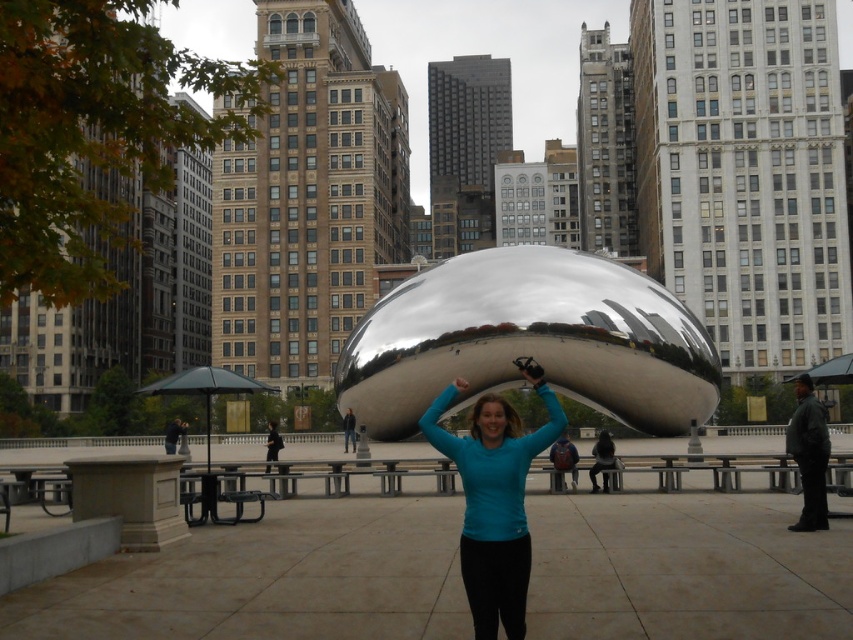
Does polished metallic sculpture at center appear on the right side of teal fabric head at center?

Correct, you'll find polished metallic sculpture at center to the right of teal fabric head at center.

At what (x,y) coordinates should I click in order to perform the action: click on polished metallic sculpture at center. Please return your answer as a coordinate pair (x, y). The image size is (853, 640). Looking at the image, I should click on (531, 340).

Where is `polished metallic sculpture at center`? This screenshot has width=853, height=640. polished metallic sculpture at center is located at coordinates (531, 340).

From the picture: Which is more to the left, teal fabric head at center or dark brown hair at center?

teal fabric head at center is more to the left.

Is teal fabric head at center to the right of dark brown hair at center from the viewer's perspective?

Incorrect, teal fabric head at center is not on the right side of dark brown hair at center.

Is point (518, 419) in front of point (799, 384)?

Yes.

The image size is (853, 640). In order to click on teal fabric head at center in this screenshot , I will do `click(503, 416)`.

Who is shorter, teal fabric shirt at center or dark brown hair at center?

dark brown hair at center

Who is more distant from viewer, [468,477] or [804,372]?

Point [804,372]

Does point (512, 436) come in front of point (798, 388)?

That is True.

You are a GUI agent. You are given a task and a screenshot of the screen. Output one action in this format:
    pyautogui.click(x=<x>, y=<y>)
    Task: Click on the teal fabric shirt at center
    
    Given the screenshot: What is the action you would take?
    pyautogui.click(x=494, y=499)